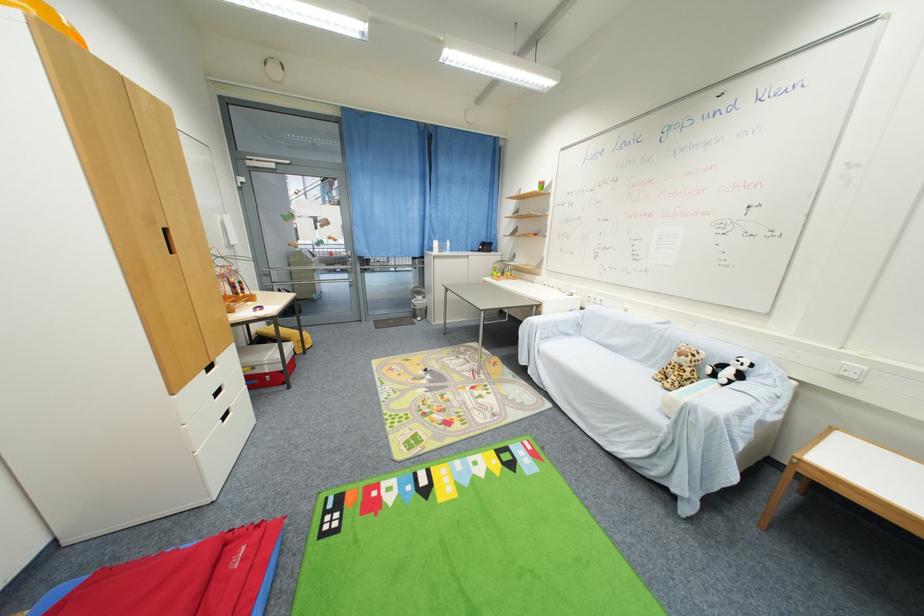
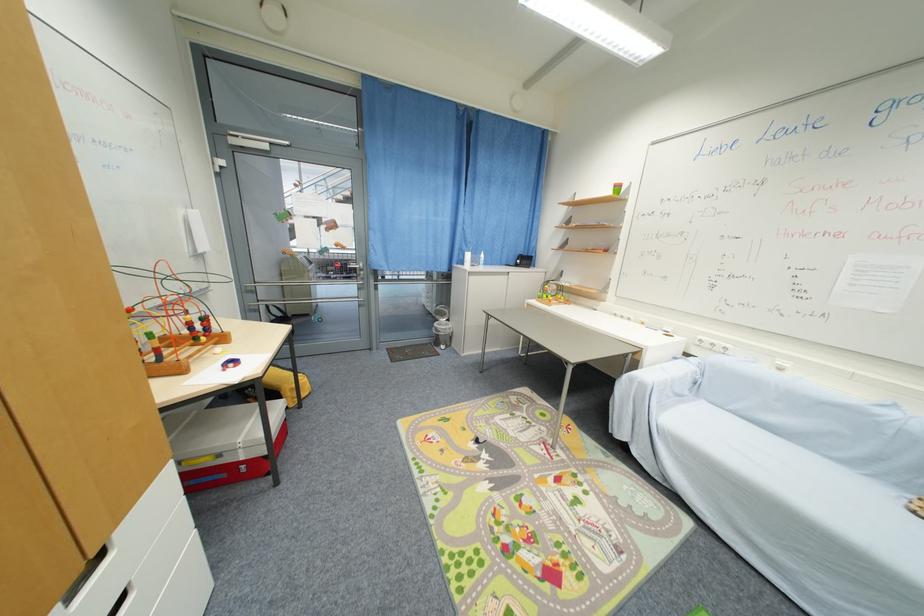
The point at (631,312) is marked in the first image. Where is the corresponding point in the second image?

(785, 371)